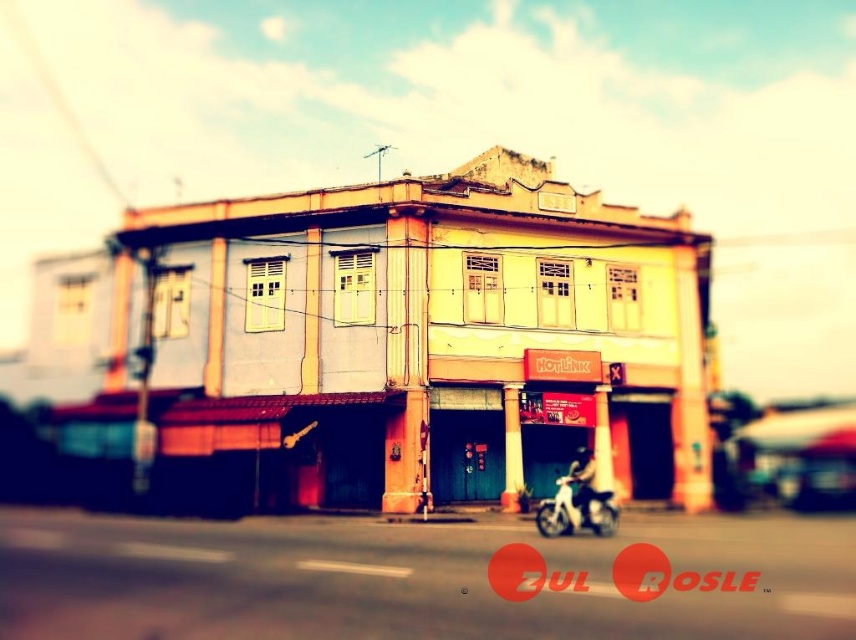
Question: Which point appears farthest from the camera in this image?

Choices:
 (A) (590, 477)
 (B) (590, 476)

Answer: (B)

Question: Does white matte motorcycle at lower center have a lesser width compared to yellow matte motorbike at center?

Choices:
 (A) no
 (B) yes

Answer: (A)

Question: Is the position of white matte motorcycle at lower center less distant than that of yellow matte motorbike at center?

Choices:
 (A) yes
 (B) no

Answer: (A)

Question: Which of the following is the farthest from the observer?

Choices:
 (A) (563, 476)
 (B) (569, 474)

Answer: (A)

Question: Is white matte motorcycle at lower center closer to camera compared to yellow matte motorbike at center?

Choices:
 (A) no
 (B) yes

Answer: (B)